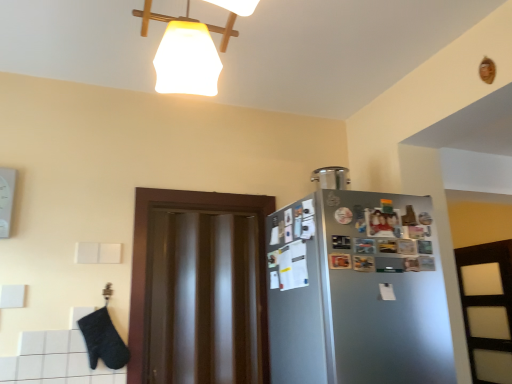
At what (x,y) coordinates should I click in order to perform the action: click on free point above transparent glossy door at center (from a real-world perspective). Please return your answer as a coordinate pair (x, y). Image resolution: width=512 pixels, height=384 pixels. Looking at the image, I should click on (210, 192).